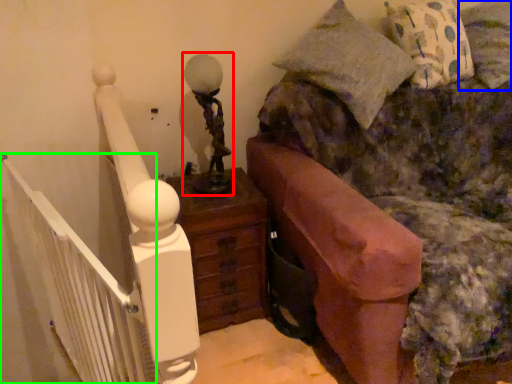
Question: Which object is positioned closest to table lamp (highlighted by a red box)? Select from pillow (highlighted by a blue box) and balustrade (highlighted by a green box).

Choices:
 (A) pillow
 (B) balustrade

Answer: (B)